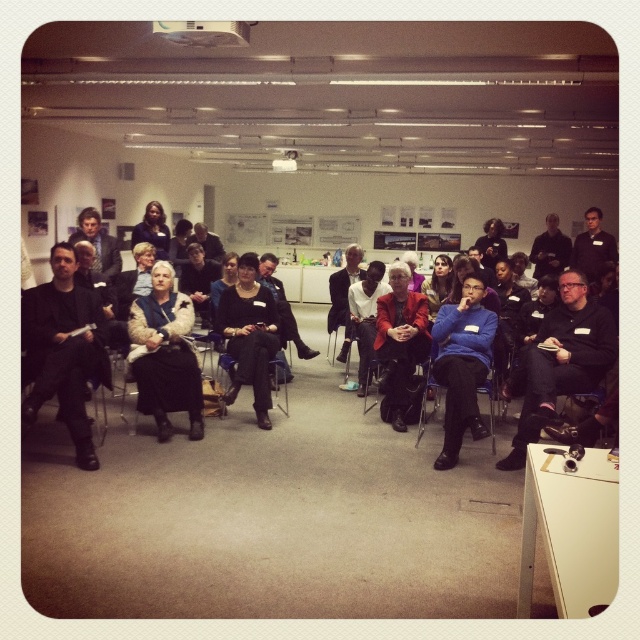
Is velvet beige dress at center closer to the viewer compared to metallic silver chair at center?

Yes, it is in front of metallic silver chair at center.

Who is positioned more to the right, velvet beige dress at center or metallic silver chair at center?

Positioned to the right is metallic silver chair at center.

The width and height of the screenshot is (640, 640). Describe the element at coordinates (164, 355) in the screenshot. I see `velvet beige dress at center` at that location.

I want to click on velvet beige dress at center, so click(x=164, y=355).

Does black fabric jacket at center appear under velvet beige dress at center?

Indeed, black fabric jacket at center is positioned under velvet beige dress at center.

In the scene shown: Who is more forward, (540,336) or (134,358)?

Point (134,358)

Who is more forward, (525, 390) or (156, 342)?

Point (525, 390)

Where is `black fabric jacket at center`? The width and height of the screenshot is (640, 640). black fabric jacket at center is located at coordinates (561, 360).

Is black fabric jacket at center positioned before matte red jacket at center?

Yes, black fabric jacket at center is in front of matte red jacket at center.

Describe the element at coordinates (561, 360) in the screenshot. I see `black fabric jacket at center` at that location.

Locate an element on the screen. black fabric jacket at center is located at coordinates (561, 360).